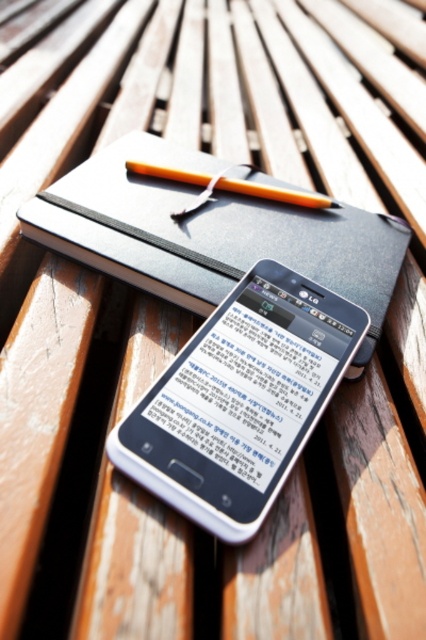
Looking at this image, you are a delivery person who needs to place a 16 inch long package on the wooden bench. The bench has a white glossy smartphone at center and an orange wood pen at center. Can you fit the package between them without moving either object?

The distance between the white glossy smartphone at center and the orange wood pen at center is 15.97 inches. Since the package is 16 inches long, it cannot fit between them as the space is slightly smaller than the package.

What object is located at the coordinates point (241, 401)?

The point (241, 401) indicates the white glossy smartphone at center.

You are standing in front of the wooden bench and want to pick up the white glossy smartphone at center. Where exactly should you look to find it?

The white glossy smartphone at center is located at point coordinates of [241,401].